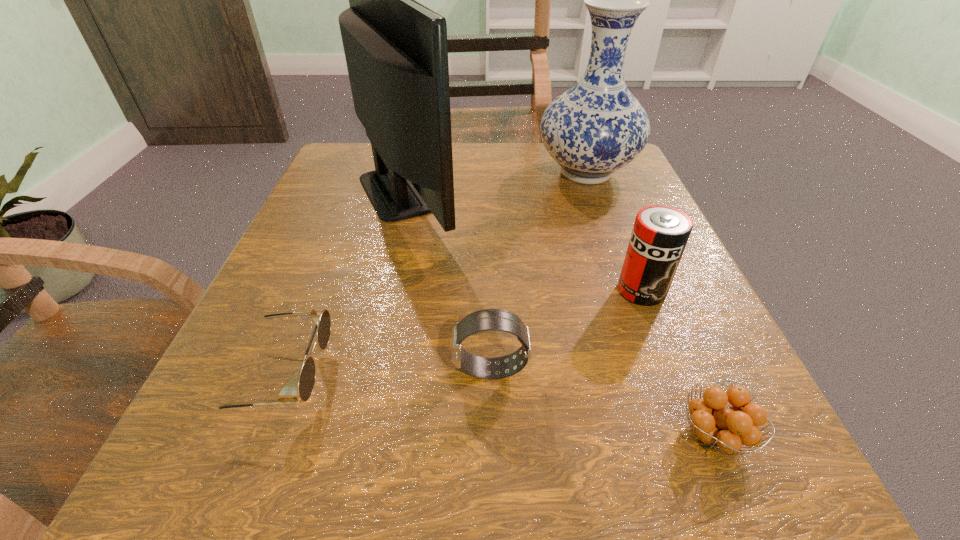
The image size is (960, 540). In order to click on unoccupied area between the third object from left to right and the computer monitor in this screenshot , I will do `click(448, 280)`.

This screenshot has width=960, height=540. I want to click on object that is the closest one to the fourth tallest object, so click(288, 395).

I want to click on object that is the third closest to the third tallest object, so click(x=597, y=127).

Locate an element on the screen. vacant space that satisfies the following two spatial constraints: 1. on the front lenses of the sunglasses; 2. on the right side of the orange fruit is located at coordinates (252, 435).

This screenshot has width=960, height=540. Identify the location of free space in the image that satisfies the following two spatial constraints: 1. on the front-facing side of the orange fruit; 2. on the left side of the computer monitor. (349, 435).

Identify the location of free space in the image that satisfies the following two spatial constraints: 1. on the front lenses of the orange fruit; 2. on the right side of the sunglasses. Image resolution: width=960 pixels, height=540 pixels. (252, 435).

Identify the location of free spot that satisfies the following two spatial constraints: 1. on the front side of the fourth nearest object; 2. on the front lenses of the sunglasses. (675, 375).